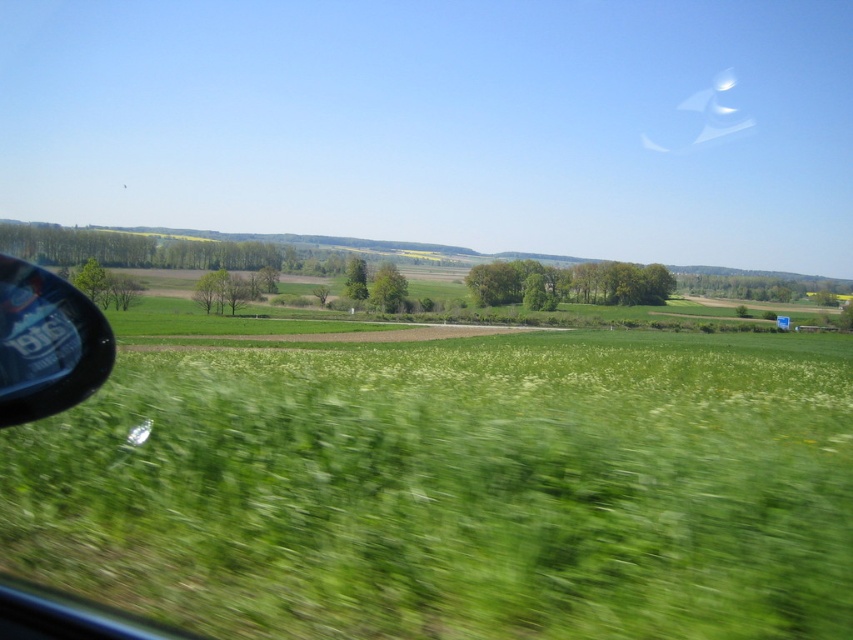
Question: Is green grass at lower left wider than transparent plastic side mirror at lower left?

Choices:
 (A) yes
 (B) no

Answer: (B)

Question: Does green grass at lower left appear on the right side of transparent plastic side mirror at lower left?

Choices:
 (A) no
 (B) yes

Answer: (B)

Question: Which point is farther to the camera?

Choices:
 (A) green grass at lower left
 (B) transparent plastic side mirror at lower left

Answer: (B)

Question: Is green grass at lower left wider than transparent plastic side mirror at lower left?

Choices:
 (A) no
 (B) yes

Answer: (A)